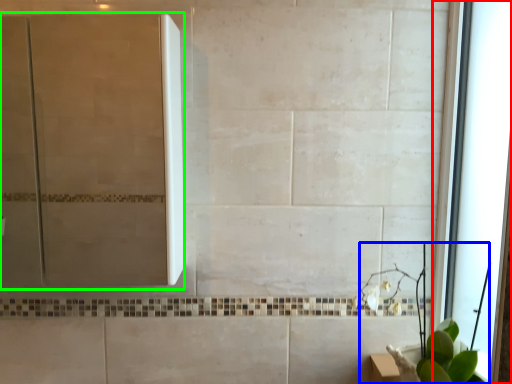
Question: Which object is the farthest from window (highlighted by a red box)? Choose among these: plant (highlighted by a blue box) or screen door (highlighted by a green box).

Choices:
 (A) plant
 (B) screen door

Answer: (B)